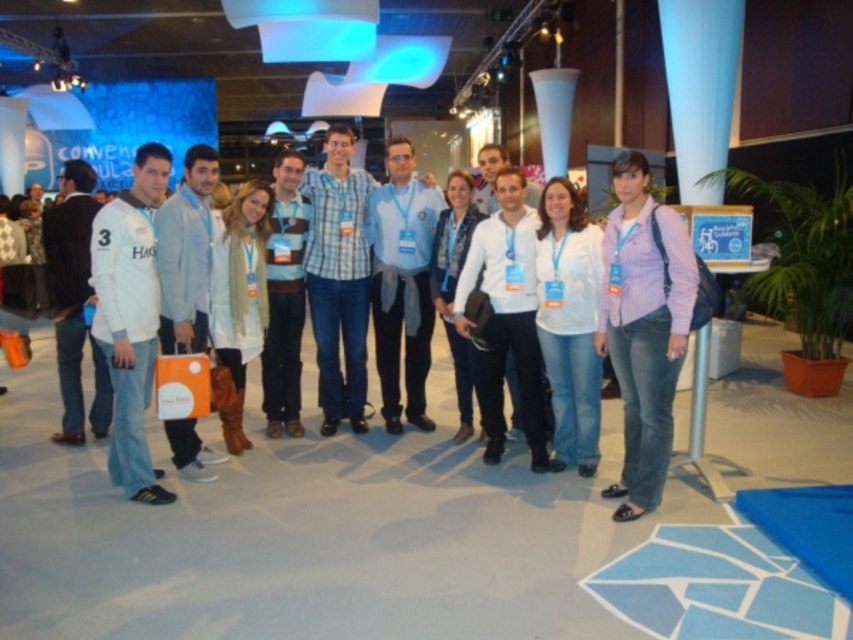
Between point (677, 300) and point (440, 429), which one is positioned behind?

Point (440, 429)

In the scene shown: Is striped cotton shirt at center behind white cotton shirt at center?

That is False.

Find the location of a particular element. This screenshot has height=640, width=853. striped cotton shirt at center is located at coordinates 643,326.

Where is `striped cotton shirt at center`? The image size is (853, 640). striped cotton shirt at center is located at coordinates coord(643,326).